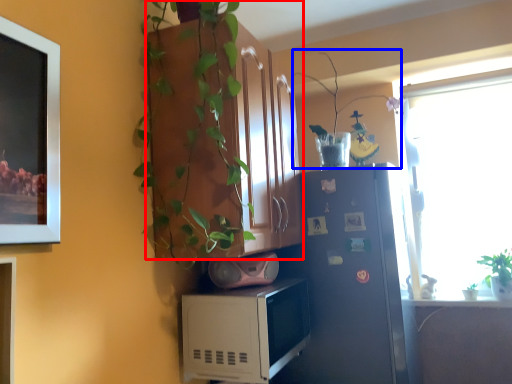
Question: Which point is closer to the camera, cabinetry (highlighted by a red box) or plant (highlighted by a blue box)?

Choices:
 (A) cabinetry
 (B) plant

Answer: (A)